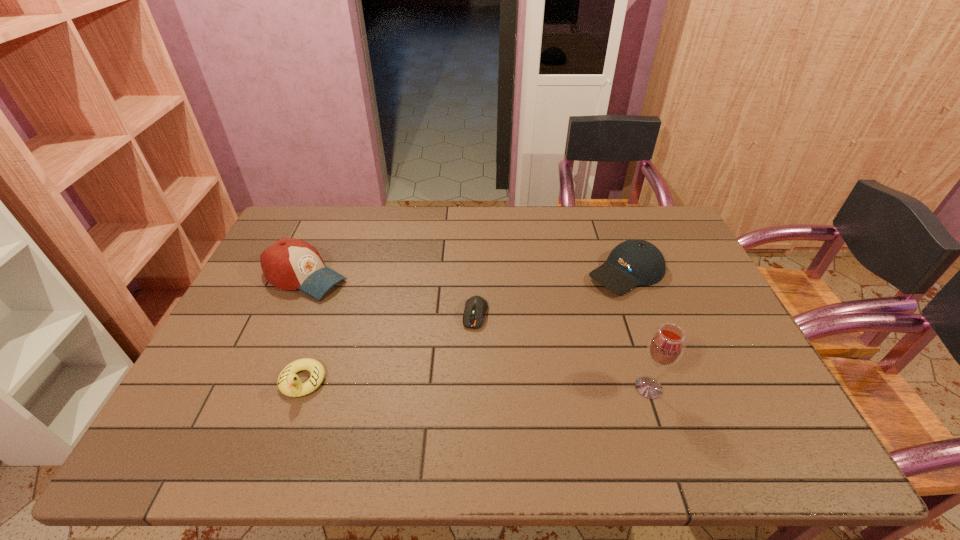
Identify the location of the fourth tallest object. (289, 383).

Locate an element on the screen. This screenshot has height=540, width=960. wineglass is located at coordinates (666, 346).

This screenshot has width=960, height=540. Identify the location of the third shortest object. (632, 263).

This screenshot has height=540, width=960. I want to click on the right baseball cap, so click(x=632, y=263).

Locate an element on the screen. This screenshot has width=960, height=540. the third object from right to left is located at coordinates (475, 307).

What are the coordinates of `computer equipment` in the screenshot? It's located at (475, 307).

What are the coordinates of `the taller baseball cap` in the screenshot? It's located at click(289, 264).

Identify the location of the left baseball cap. (289, 264).

This screenshot has width=960, height=540. Identify the location of vacant area situated on the left of the wineglass. (479, 388).

Find the location of a particular element. The height and width of the screenshot is (540, 960). vacant area situated on the front-facing side of the right baseball cap is located at coordinates (500, 352).